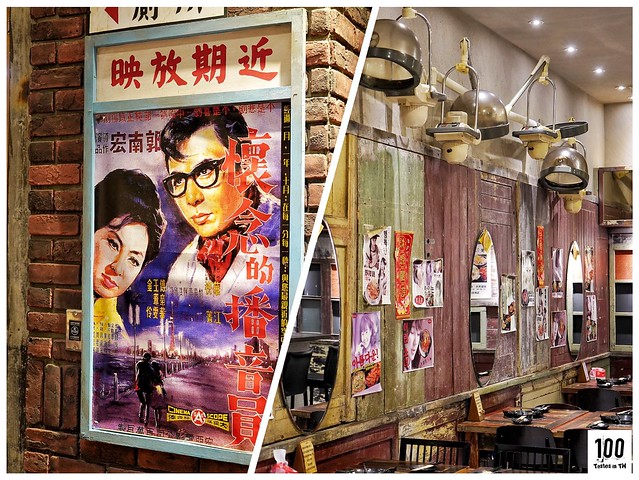
Locate an element on the screen. The width and height of the screenshot is (639, 480). the 2nd hairdryer is located at coordinates (491, 120).